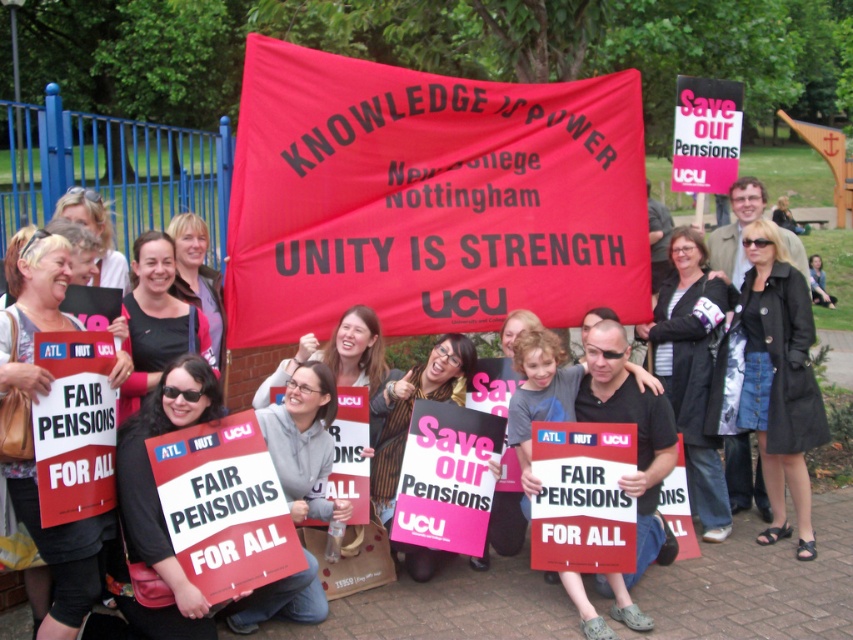
Question: Where is red fabric banner at center located in relation to matte black jacket at center in the image?

Choices:
 (A) right
 (B) left

Answer: (B)

Question: Does red fabric banner at center appear on the right side of matte black jacket at center?

Choices:
 (A) no
 (B) yes

Answer: (A)

Question: Is red fabric banner at center further to the viewer compared to matte black jacket at center?

Choices:
 (A) no
 (B) yes

Answer: (B)

Question: Among these points, which one is farthest from the camera?

Choices:
 (A) (339, 240)
 (B) (531, 636)

Answer: (A)

Question: Which object is farther from the camera taking this photo?

Choices:
 (A) red fabric banner at center
 (B) matte black jacket at center

Answer: (A)

Question: Which of the following is the farthest from the observer?

Choices:
 (A) (558, 248)
 (B) (283, 636)

Answer: (A)